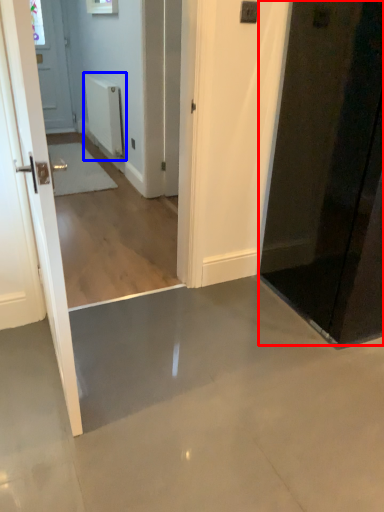
Question: Which object appears closest to the camera in this image, door (highlighted by a red box) or radiator (highlighted by a blue box)?

Choices:
 (A) door
 (B) radiator

Answer: (A)